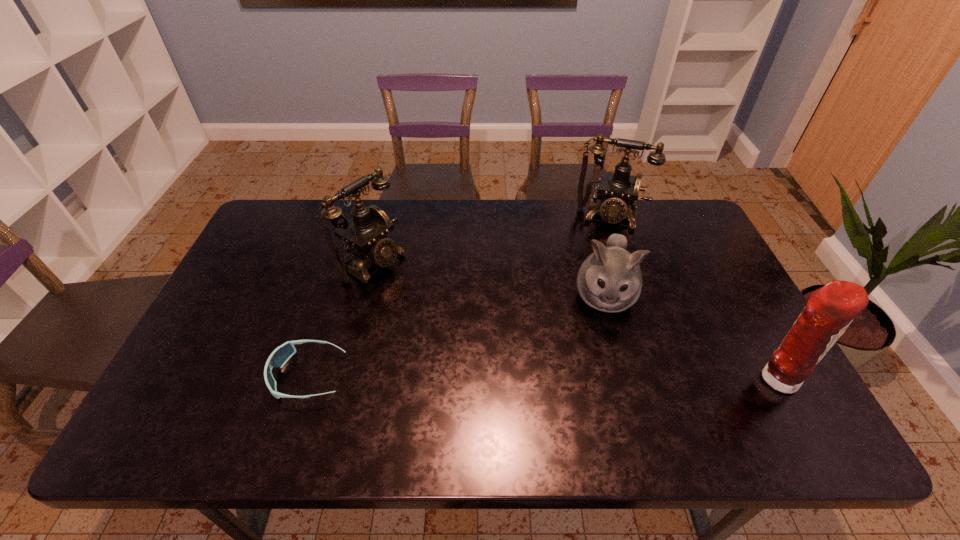
Find the location of a particular element. object positioned at the right edge is located at coordinates (829, 311).

At what (x,y) coordinates should I click in order to perform the action: click on object located in the near right corner section of the desktop. Please return your answer as a coordinate pair (x, y). The height and width of the screenshot is (540, 960). Looking at the image, I should click on (829, 311).

Locate an element on the screen. vacant space at the far edge is located at coordinates (399, 201).

This screenshot has height=540, width=960. What are the coordinates of `free spot at the near edge of the desktop` in the screenshot? It's located at (448, 375).

This screenshot has width=960, height=540. Find the location of `vacant area at the right edge of the desktop`. vacant area at the right edge of the desktop is located at coordinates point(699,259).

Where is `free space at the far left corner of the desktop`? free space at the far left corner of the desktop is located at coordinates (280, 221).

Locate an element on the screen. This screenshot has width=960, height=540. vacant region at the far right corner is located at coordinates (664, 217).

What are the coordinates of `vacant space that is in between the goggles and the hamster` in the screenshot? It's located at (456, 336).

Find the location of a particular element. unoccupied area between the left telephone and the condiment is located at coordinates (574, 320).

The height and width of the screenshot is (540, 960). I want to click on empty location between the farther telephone and the shortest object, so click(x=458, y=296).